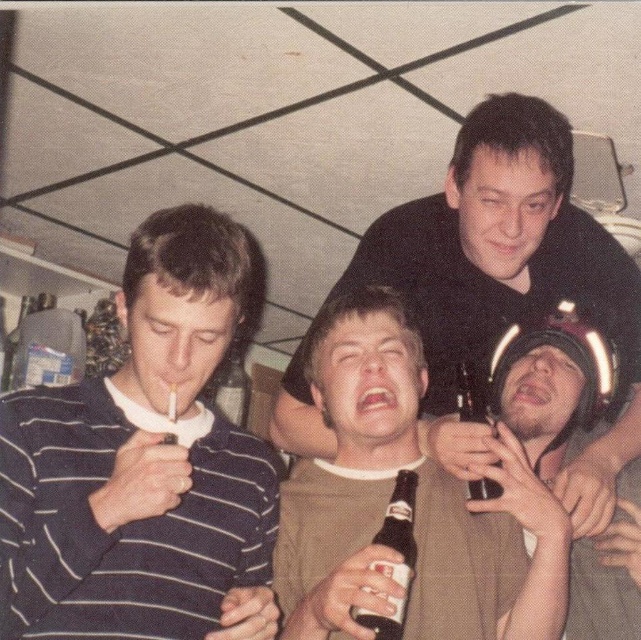
Question: Among these objects, which one is farthest from the camera?

Choices:
 (A) black matte shirt at center
 (B) clear glass bottle at center
 (C) brown fabric shirt at center

Answer: (B)

Question: Is brown fabric shirt at center behind clear glass bottle at center?

Choices:
 (A) no
 (B) yes

Answer: (A)

Question: Can you confirm if brown fabric shirt at center is positioned to the left of clear glass bottle at center?

Choices:
 (A) yes
 (B) no

Answer: (B)

Question: Does dark brown glass bottle at center appear on the left side of translucent glass beer bottle at lower right?

Choices:
 (A) yes
 (B) no

Answer: (A)

Question: Which point is closer to the camera?

Choices:
 (A) dark brown glass bottle at center
 (B) dark blue striped shirt at left
 (C) clear glass bottle at center
 (D) black matte shirt at center

Answer: (A)

Question: Among these points, which one is farthest from the camera?

Choices:
 (A) [487, 420]
 (B) [472, 490]

Answer: (A)